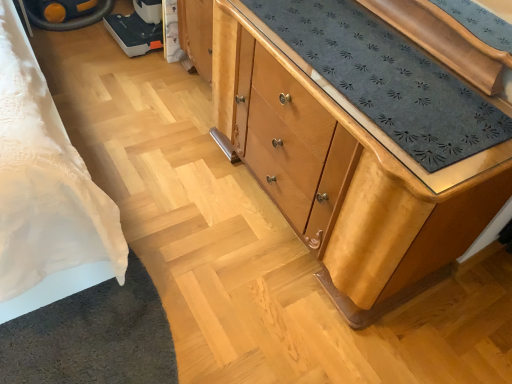
Image resolution: width=512 pixels, height=384 pixels. Find the location of `free space to the left of light brown wood chest of drawers at center`. free space to the left of light brown wood chest of drawers at center is located at coordinates (167, 162).